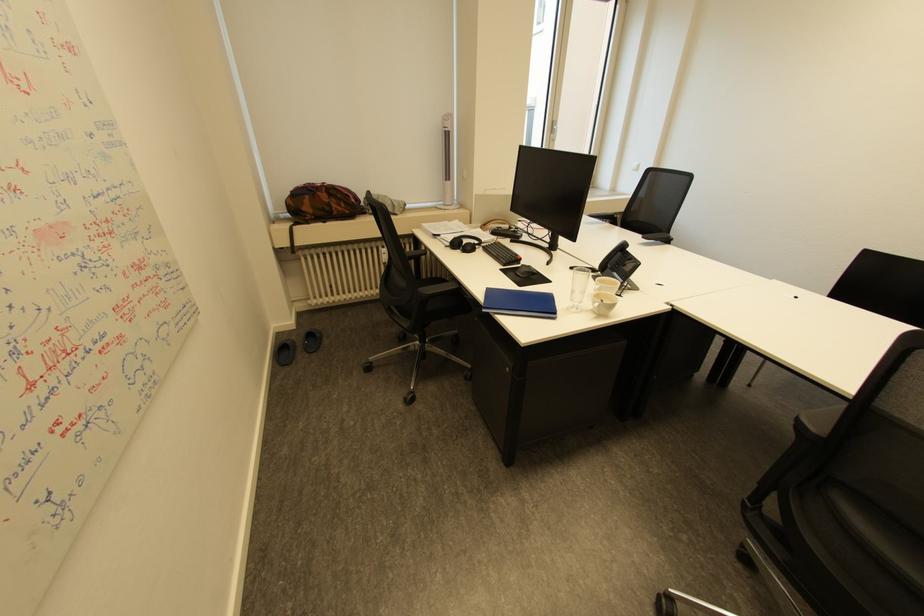
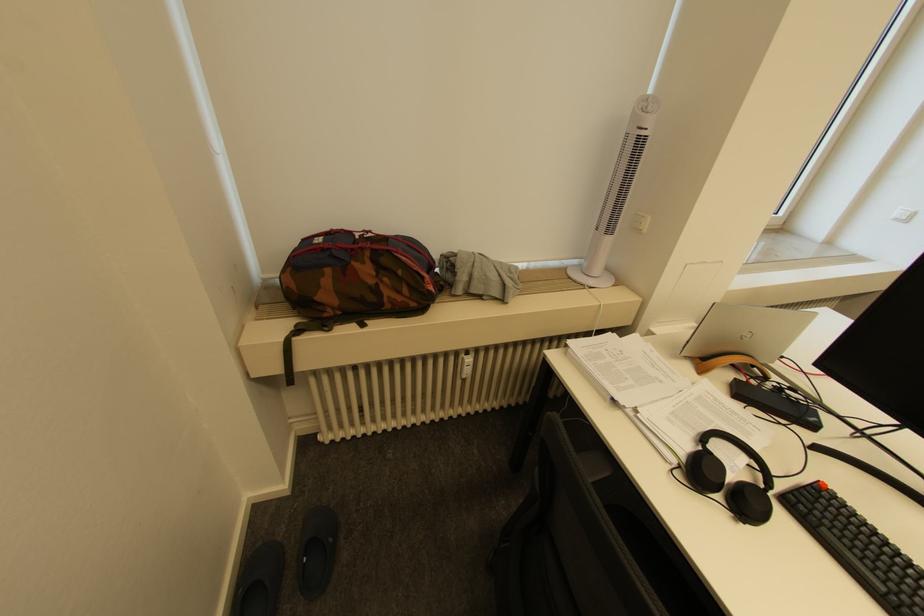
In the scene shown: The images are taken continuously from a first-person perspective. In which direction are you moving?

The cameraman moved toward left, forward.